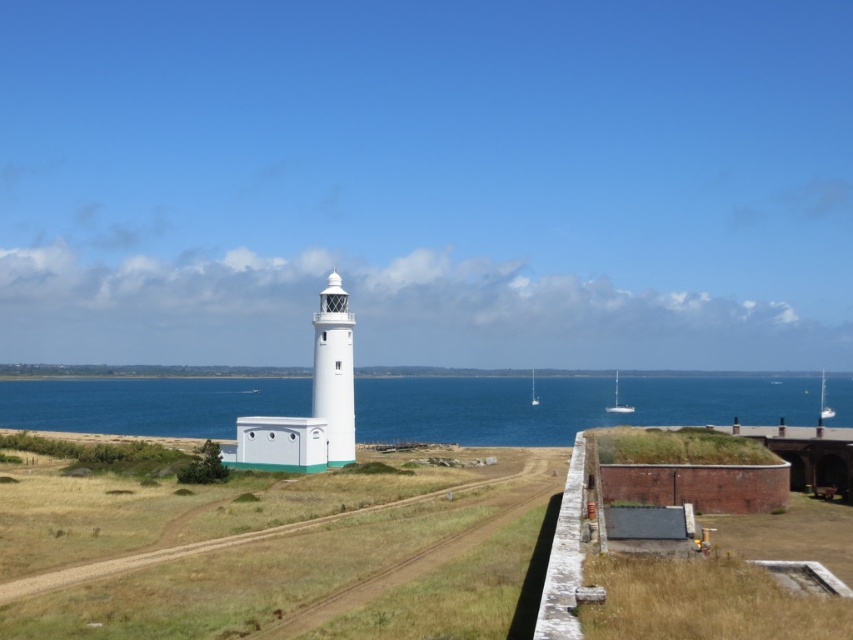
Which is more to the left, white glossy sailboat at upper right or white glossy sailboat at center?

Positioned to the left is white glossy sailboat at center.

Between white glossy sailboat at upper right and white glossy sailboat at center, which one has less height?

With less height is white glossy sailboat at upper right.

Which is in front, point (822, 385) or point (534, 381)?

Point (822, 385) is in front.

You are a GUI agent. You are given a task and a screenshot of the screen. Output one action in this format:
    pyautogui.click(x=<x>, y=<y>)
    Task: Click on the white glossy sailboat at upper right
    This screenshot has width=853, height=640.
    Given the screenshot: What is the action you would take?
    pyautogui.click(x=824, y=401)

Is point (201, 492) closer to camera compared to point (611, 406)?

Yes, point (201, 492) is in front of point (611, 406).

Between dry grass at center and white glossy sailboat at right, which one is positioned lower?

white glossy sailboat at right

Locate an element on the screen. The height and width of the screenshot is (640, 853). dry grass at center is located at coordinates (276, 556).

Find the location of a particular element. The image size is (853, 640). dry grass at center is located at coordinates (276, 556).

Between white glossy sailboat at right and white glossy sailboat at center, which one has more height?

white glossy sailboat at right

Who is more forward, (616, 404) or (532, 396)?

Positioned in front is point (616, 404).

Identify the location of white glossy sailboat at right. (618, 401).